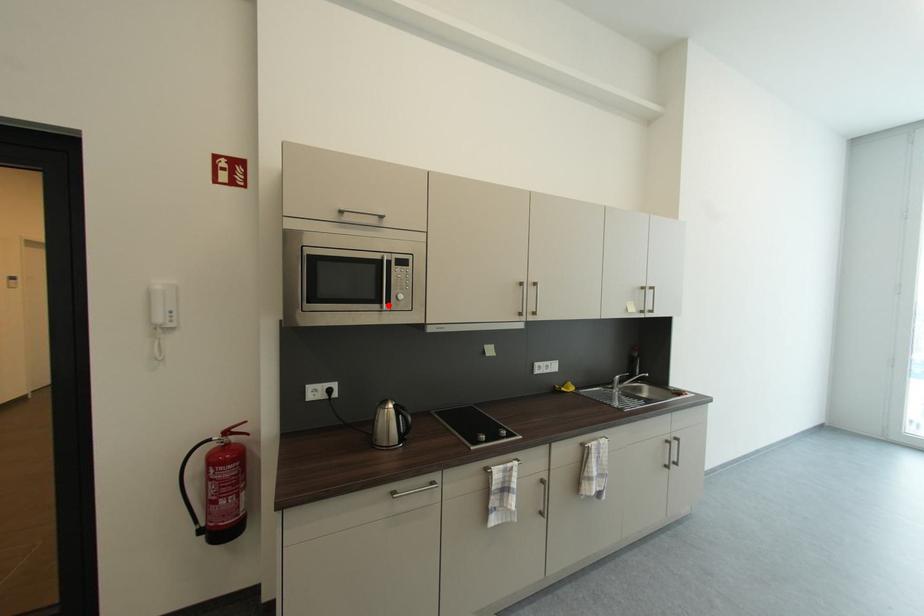
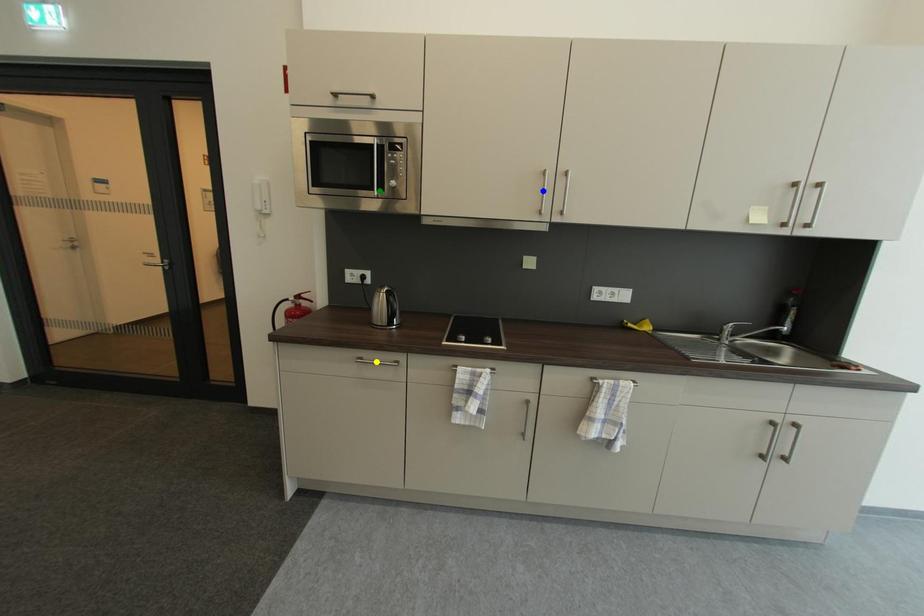
Question: I am providing you with two images of the same scene from different viewpoints. A red point is marked on the first image. You are given multiple points on the second image. In image 2, which mark is for the same physical point as the one in image 1?

Choices:
 (A) green point
 (B) yellow point
 (C) blue point

Answer: (A)